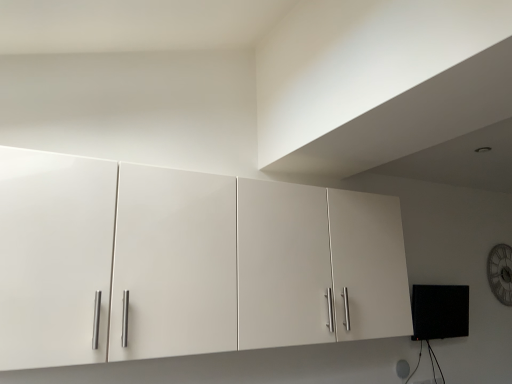
Question: Considering the relative sizes of wooden clock at upper right and white glossy cabinet at upper center in the image provided, is wooden clock at upper right shorter than white glossy cabinet at upper center?

Choices:
 (A) no
 (B) yes

Answer: (B)

Question: Considering the relative sizes of wooden clock at upper right and white glossy cabinet at upper center in the image provided, is wooden clock at upper right wider than white glossy cabinet at upper center?

Choices:
 (A) no
 (B) yes

Answer: (A)

Question: From the image's perspective, is wooden clock at upper right on white glossy cabinet at upper center?

Choices:
 (A) yes
 (B) no

Answer: (B)

Question: Considering the relative sizes of wooden clock at upper right and white glossy cabinet at upper center in the image provided, is wooden clock at upper right taller than white glossy cabinet at upper center?

Choices:
 (A) no
 (B) yes

Answer: (A)

Question: Is white glossy cabinet at upper center at the back of wooden clock at upper right?

Choices:
 (A) yes
 (B) no

Answer: (B)

Question: From the image's perspective, does wooden clock at upper right appear lower than white glossy cabinet at upper center?

Choices:
 (A) no
 (B) yes

Answer: (B)

Question: Does white glossy cabinet at upper center have a lesser height compared to wooden clock at upper right?

Choices:
 (A) no
 (B) yes

Answer: (A)

Question: Can you confirm if white glossy cabinet at upper center is thinner than wooden clock at upper right?

Choices:
 (A) yes
 (B) no

Answer: (B)

Question: From a real-world perspective, is white glossy cabinet at upper center under wooden clock at upper right?

Choices:
 (A) no
 (B) yes

Answer: (A)

Question: Does white glossy cabinet at upper center have a greater width compared to wooden clock at upper right?

Choices:
 (A) yes
 (B) no

Answer: (A)

Question: Is white glossy cabinet at upper center looking in the opposite direction of wooden clock at upper right?

Choices:
 (A) no
 (B) yes

Answer: (A)

Question: Is white glossy cabinet at upper center oriented towards wooden clock at upper right?

Choices:
 (A) yes
 (B) no

Answer: (B)

Question: Looking at their shapes, would you say white glossy cabinet at upper center is wider or thinner than wooden clock at upper right?

Choices:
 (A) wide
 (B) thin

Answer: (A)